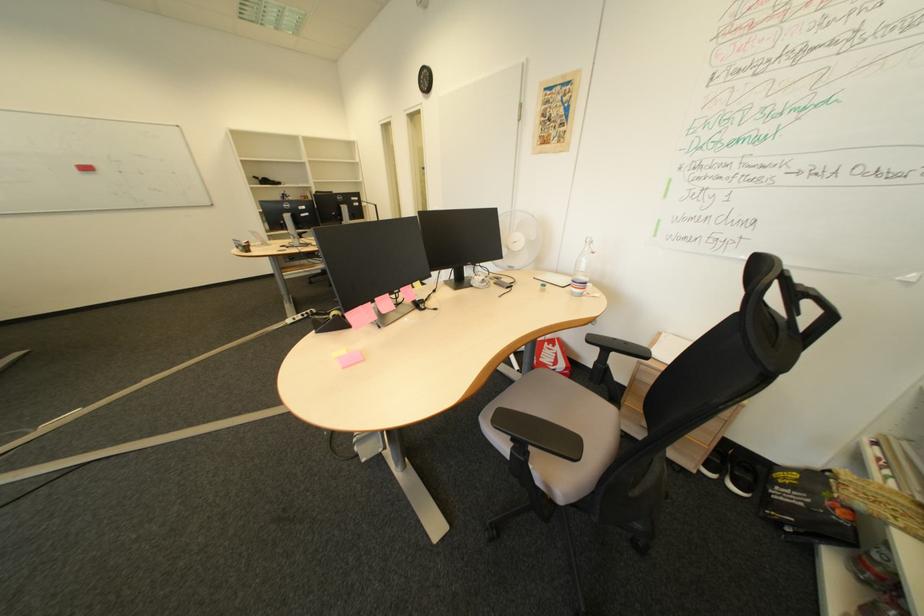
Find the location of a particular element. red shoe box is located at coordinates (552, 355).